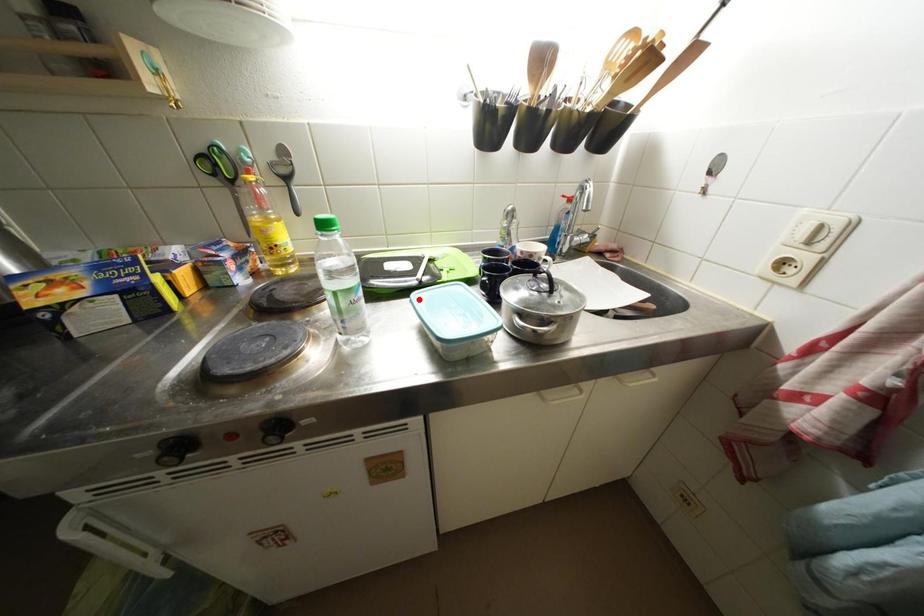
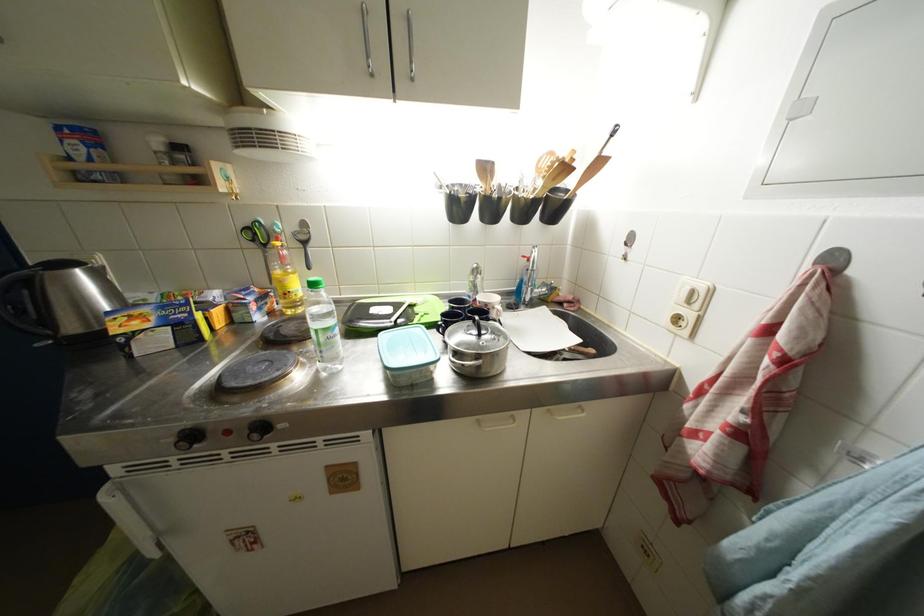
In the second image, find the point that corresponds to the highlighted location in the first image.

(386, 339)